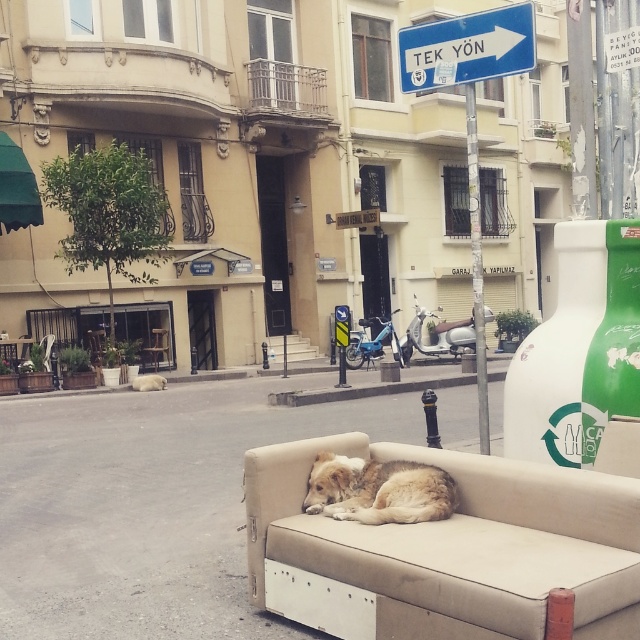
Question: Can you confirm if beige fabric couch at center is bigger than golden fur dog at center?

Choices:
 (A) yes
 (B) no

Answer: (A)

Question: Is golden fur dog at center below gray concrete curb at center?

Choices:
 (A) yes
 (B) no

Answer: (B)

Question: Considering the real-world distances, which object is farthest from the beige fabric couch at center?

Choices:
 (A) blue plastic sign at upper center
 (B) golden fur dog at center

Answer: (A)

Question: Which point is farther to the camera?

Choices:
 (A) golden fur dog at center
 (B) gray concrete curb at center

Answer: (B)

Question: Can you confirm if beige fabric couch at center is thinner than gray concrete curb at center?

Choices:
 (A) no
 (B) yes

Answer: (A)

Question: Which object appears farthest from the camera in this image?

Choices:
 (A) beige fabric couch at center
 (B) gray concrete curb at center
 (C) golden fur dog at center

Answer: (B)